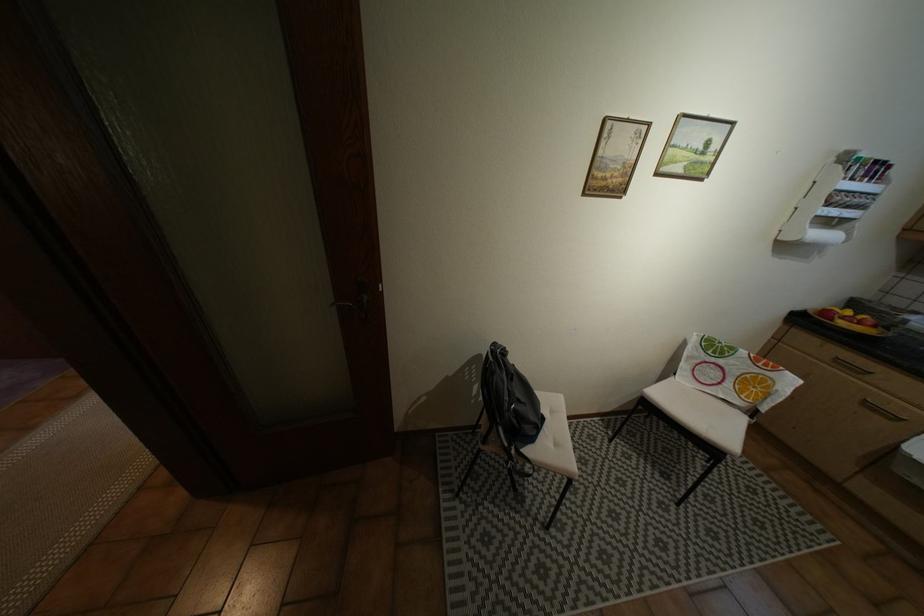
Find the location of a particular element. dark door handle is located at coordinates (359, 299).